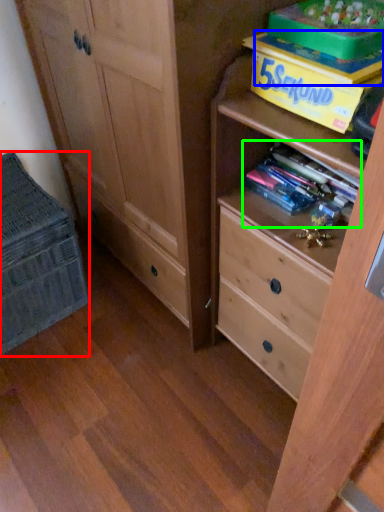
Question: Considering the real-world distances, which object is farthest from cabinetry (highlighted by a red box)? book (highlighted by a blue box) or book (highlighted by a green box)?

Choices:
 (A) book
 (B) book

Answer: (A)